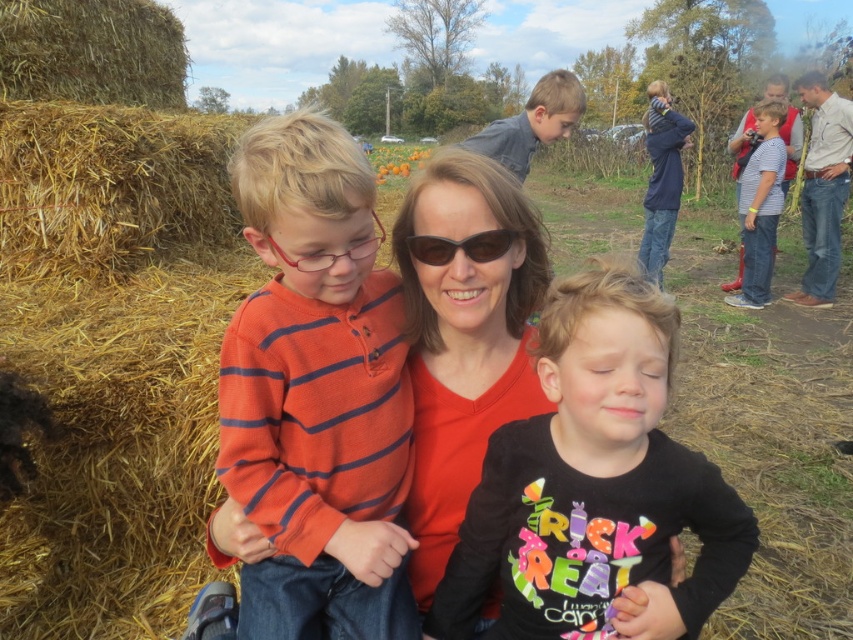
Can you confirm if matte orange sweater at center is wider than blue denim jacket at upper center?

In fact, matte orange sweater at center might be narrower than blue denim jacket at upper center.

Who is shorter, matte orange sweater at center or blue denim jacket at upper center?

matte orange sweater at center

What do you see at coordinates (463, 333) in the screenshot? I see `matte orange sweater at center` at bounding box center [463, 333].

Where is `matte orange sweater at center`? The width and height of the screenshot is (853, 640). matte orange sweater at center is located at coordinates (463, 333).

Who is lower down, orange striped sweater at left or brown straw bale at left?

orange striped sweater at left is lower down.

Does point (289, 634) lie behind point (183, 96)?

No, it is in front of (183, 96).

The image size is (853, 640). I want to click on orange striped sweater at left, so click(x=317, y=394).

Does orange striped sweater at left have a greater height compared to striped cotton shirt at right?

In fact, orange striped sweater at left may be shorter than striped cotton shirt at right.

Which is below, orange striped sweater at left or striped cotton shirt at right?

orange striped sweater at left is below.

This screenshot has height=640, width=853. In order to click on orange striped sweater at left in this screenshot , I will do `click(317, 394)`.

The width and height of the screenshot is (853, 640). I want to click on orange striped sweater at left, so click(317, 394).